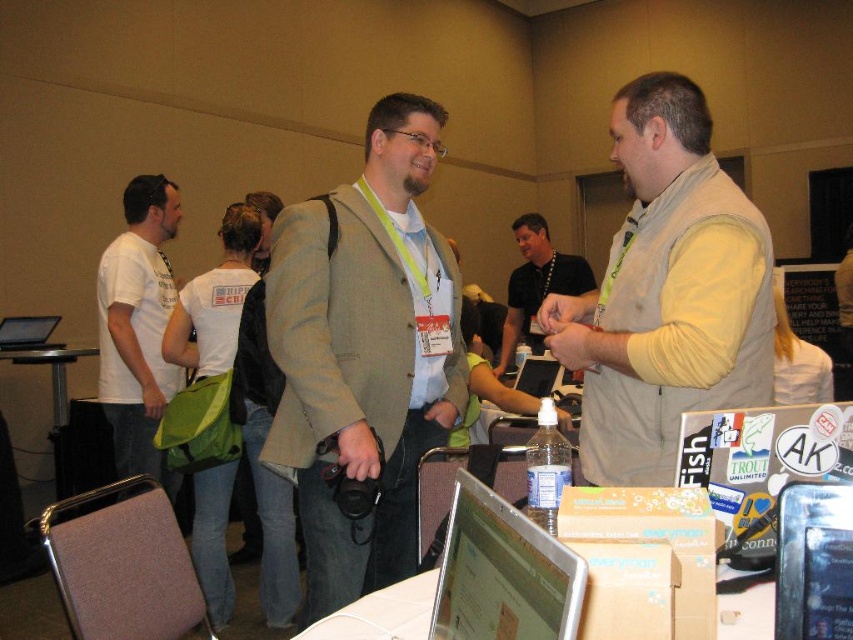
Is point (276, 289) in front of point (61, 454)?

Yes, it is in front of point (61, 454).

Can you confirm if light brown textured blazer at center is taller than metallic silver table at lower left?

Yes.

Is point (339, 307) positioned in front of point (56, 380)?

That is True.

The height and width of the screenshot is (640, 853). Find the location of `light brown textured blazer at center`. light brown textured blazer at center is located at coordinates (364, 355).

You are a GUI agent. You are given a task and a screenshot of the screen. Output one action in this format:
    pyautogui.click(x=<x>, y=<y>)
    Task: Click on the light beige vest at center
    The image size is (853, 640).
    Given the screenshot: What is the action you would take?
    pyautogui.click(x=666, y=292)

Measure the distance from light beige vest at center to metallic blue computer at lower right.

The distance of light beige vest at center from metallic blue computer at lower right is 30.98 inches.

Is point (637, 445) farther from viewer compared to point (840, 529)?

Yes.

In order to click on light beige vest at center in this screenshot , I will do `click(666, 292)`.

Between silver metallic laptop at center and black shirt at center, which one is positioned higher?

black shirt at center

Which is behind, point (527, 588) or point (572, 282)?

Positioned behind is point (572, 282).

The height and width of the screenshot is (640, 853). What do you see at coordinates (503, 573) in the screenshot? I see `silver metallic laptop at center` at bounding box center [503, 573].

Locate an element on the screen. silver metallic laptop at center is located at coordinates (503, 573).